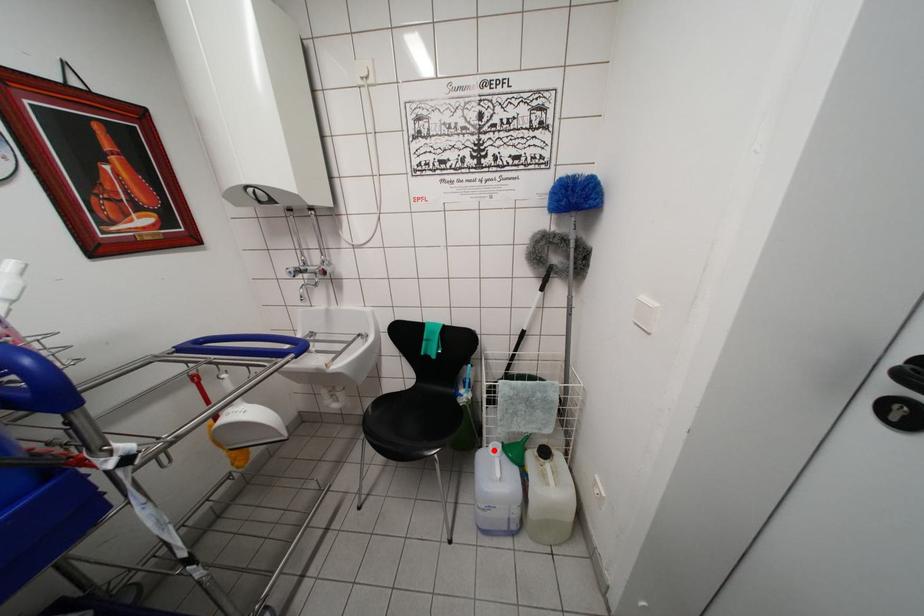
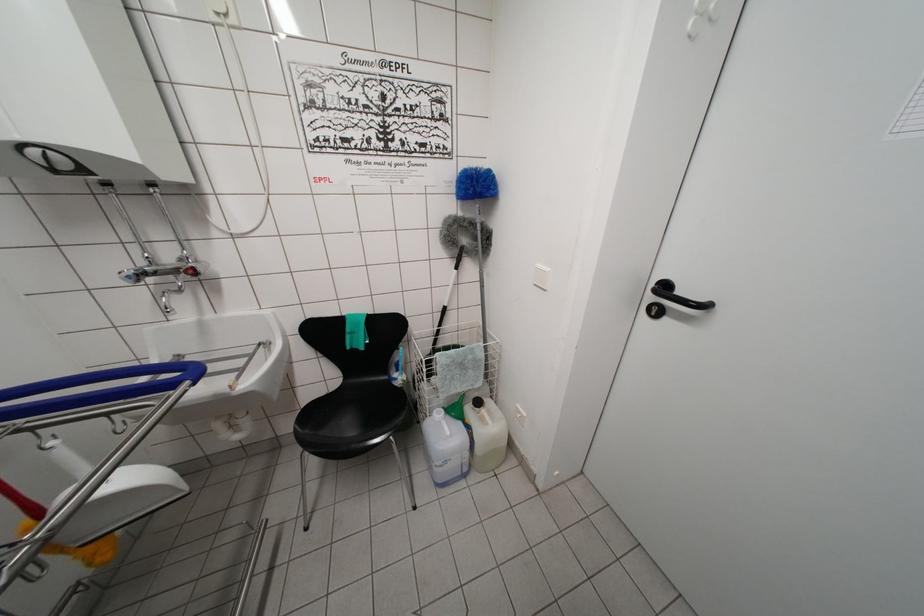
Where in the second image is the point corresponding to the highlighted location from the first image?

(438, 418)